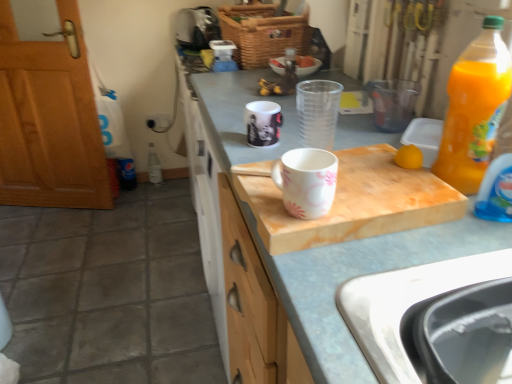
Locate an element on the screen. white glossy mug at center, the first coffee cup positioned from the top is located at coordinates (263, 123).

This screenshot has height=384, width=512. What do you see at coordinates (306, 181) in the screenshot? I see `white glossy mug at center, which ranks as the 2th coffee cup in back-to-front order` at bounding box center [306, 181].

Describe the element at coordinates (357, 275) in the screenshot. I see `white marble cutting board at center` at that location.

Find the location of a particular element. The height and width of the screenshot is (384, 512). black plastic sink at lower right is located at coordinates (406, 305).

Is white marble cutting board at center wider than white glossy mug at center, which is the 2th coffee cup from bottom to top?

Yes.

Who is shorter, white marble cutting board at center or white glossy mug at center, which ranks as the first coffee cup in back-to-front order?

With less height is white glossy mug at center, which ranks as the first coffee cup in back-to-front order.

From a real-world perspective, who is located higher, white marble cutting board at center or white glossy mug at center, which is the 2th coffee cup from bottom to top?

white glossy mug at center, which is the 2th coffee cup from bottom to top, is physically above.

In the scene shown: In the image, is white marble cutting board at center positioned in front of or behind white glossy mug at center, which is the 2th coffee cup from bottom to top?

white marble cutting board at center is behind white glossy mug at center, which is the 2th coffee cup from bottom to top.

From a real-world perspective, is woven brown basket at upper center physically below white glossy mug at center, the 1th coffee cup positioned from the bottom?

No, from a real-world perspective, woven brown basket at upper center is not below white glossy mug at center, the 1th coffee cup positioned from the bottom.

Between woven brown basket at upper center and white glossy mug at center, the 1th coffee cup positioned from the bottom, which one has smaller size?

white glossy mug at center, the 1th coffee cup positioned from the bottom.

What's the angular difference between woven brown basket at upper center and white glossy mug at center, acting as the first coffee cup starting from the front,'s facing directions?

There is a 120-degree angle between the facing directions of woven brown basket at upper center and white glossy mug at center, acting as the first coffee cup starting from the front.

Find the location of a particular element. The height and width of the screenshot is (384, 512). basket above the white glossy mug at center, acting as the first coffee cup starting from the front (from a real-world perspective) is located at coordinates (262, 33).

Does white marble cutting board at center have a larger size compared to translucent plastic bottle at right, which is counted as the 2th bottle, starting from the left?

Correct, white marble cutting board at center is larger in size than translucent plastic bottle at right, which is counted as the 2th bottle, starting from the left.

Considering the relative sizes of white marble cutting board at center and translucent plastic bottle at right, which appears as the 1th bottle when viewed from the front, in the image provided, is white marble cutting board at center shorter than translucent plastic bottle at right, which appears as the 1th bottle when viewed from the front,?

Incorrect, the height of white marble cutting board at center does not fall short of that of translucent plastic bottle at right, which appears as the 1th bottle when viewed from the front.

Is translucent plastic bottle at right, which is counted as the 2th bottle, starting from the left, a part of white marble cutting board at center?

No, translucent plastic bottle at right, which is counted as the 2th bottle, starting from the left, is located outside of white marble cutting board at center.

Between point (353, 137) and point (504, 49), which one is positioned behind?

The point (353, 137) is more distant.

Which is in front, point (290, 152) or point (259, 8)?

Positioned in front is point (290, 152).

This screenshot has height=384, width=512. Identify the location of coffee cup that is the 1st one below the woven brown basket at upper center (from a real-world perspective). (306, 181).

Considering the sizes of objects white glossy mug at center, acting as the first coffee cup starting from the front, and woven brown basket at upper center in the image provided, who is smaller, white glossy mug at center, acting as the first coffee cup starting from the front, or woven brown basket at upper center?

Smaller between the two is white glossy mug at center, acting as the first coffee cup starting from the front.

The image size is (512, 384). Identify the location of sink directly beneath the translucent plastic bottle at center, which is the 1th bottle from back to front (from a real-world perspective). (406, 305).

Is the depth of black plastic sink at lower right less than that of translucent plastic bottle at center, positioned as the 1th bottle in top-to-bottom order?

Yes, black plastic sink at lower right is in front of translucent plastic bottle at center, positioned as the 1th bottle in top-to-bottom order.

Is black plastic sink at lower right to the left or to the right of translucent plastic bottle at center, which ranks as the second bottle in right-to-left order, in the image?

Based on their positions, black plastic sink at lower right is located to the right of translucent plastic bottle at center, which ranks as the second bottle in right-to-left order.

Is black plastic sink at lower right far away from translucent plastic bottle at center, which is the 1th bottle from back to front?

Yes, black plastic sink at lower right is far from translucent plastic bottle at center, which is the 1th bottle from back to front.

Considering their positions, is black plastic sink at lower right located in front of or behind translucent plastic bottle at right, which is counted as the 2th bottle, starting from the left?

black plastic sink at lower right is in front of translucent plastic bottle at right, which is counted as the 2th bottle, starting from the left.

From the image's perspective, is black plastic sink at lower right located above or below translucent plastic bottle at right, the first bottle in the bottom-to-top sequence?

black plastic sink at lower right is situated lower than translucent plastic bottle at right, the first bottle in the bottom-to-top sequence, in the image.

Is black plastic sink at lower right looking in the opposite direction of translucent plastic bottle at right, the 2th bottle from the back?

black plastic sink at lower right is not turned away from translucent plastic bottle at right, the 2th bottle from the back.

Based on the photo, in the image, is white marble cutting board at center positioned in front of or behind white marble cutting board at center?

Visually, white marble cutting board at center is located in front of white marble cutting board at center.

From a real-world perspective, is white marble cutting board at center located higher than white marble cutting board at center?

Yes, from a real-world perspective, white marble cutting board at center is over white marble cutting board at center

Can white marble cutting board at center be found inside white marble cutting board at center?

No.

Considering the sizes of white marble cutting board at center and white marble cutting board at center in the image, is white marble cutting board at center taller or shorter than white marble cutting board at center?

Clearly, white marble cutting board at center is shorter compared to white marble cutting board at center.

There is a white marble cutting board at center. Identify the location of the 2nd coffee cup above it (from the image's perspective). This screenshot has height=384, width=512. (263, 123).

From a real-world perspective, which coffee cup is the 1st one underneath the woven brown basket at upper center? Please provide its 2D coordinates.

[(306, 181)]

Based on the photo, when comparing their distances from wooden door at left, does translucent plastic bottle at right, the first bottle in the bottom-to-top sequence, or translucent plastic bottle at center, positioned as the second bottle in bottom-to-top order, seem further?

translucent plastic bottle at right, the first bottle in the bottom-to-top sequence, is further to wooden door at left.

Estimate the real-world distances between objects in this image. Which object is closer to white marble cutting board at center, white glossy mug at center, which ranks as the first coffee cup in back-to-front order, or wooden door at left?

The object closer to white marble cutting board at center is white glossy mug at center, which ranks as the first coffee cup in back-to-front order.

When comparing their distances from white marble cutting board at center, does white glossy mug at center, acting as the first coffee cup starting from the front, or white marble cutting board at center seem further?

Among the two, white marble cutting board at center is located further to white marble cutting board at center.

From the image, which object appears to be nearer to white glossy mug at center, the first coffee cup positioned from the top, wooden door at left or white glossy mug at center, acting as the 2th coffee cup starting from the top?

white glossy mug at center, acting as the 2th coffee cup starting from the top, lies closer to white glossy mug at center, the first coffee cup positioned from the top, than the other object.

Which object lies further to the anchor point wooden door at left, white glossy mug at center, acting as the first coffee cup starting from the front, or white marble cutting board at center?

Among the two, white glossy mug at center, acting as the first coffee cup starting from the front, is located further to wooden door at left.

Looking at this image, estimate the real-world distances between objects in this image. Which object is closer to black plastic sink at lower right, translucent plastic bottle at center, which ranks as the second bottle in right-to-left order, or white glossy mug at center, acting as the 2th coffee cup starting from the top?

Among the two, white glossy mug at center, acting as the 2th coffee cup starting from the top, is located nearer to black plastic sink at lower right.

From the image, which object appears to be farther from white marble cutting board at center, white glossy mug at center, the second coffee cup positioned from the front, or black plastic sink at lower right?

white glossy mug at center, the second coffee cup positioned from the front, is positioned further to the anchor white marble cutting board at center.

When comparing their distances from translucent plastic bottle at right, which is counted as the 2th bottle, starting from the left, does woven brown basket at upper center or white marble cutting board at center seem closer?

white marble cutting board at center is positioned closer to the anchor translucent plastic bottle at right, which is counted as the 2th bottle, starting from the left.

Identify the location of coffee cup between white glossy mug at center, acting as the first coffee cup starting from the front, and translucent plastic bottle at center, the 1th bottle from the left, in the front-back direction. This screenshot has width=512, height=384. (263, 123).

Locate an element on the screen. cutting board positioned between white glossy mug at center, which ranks as the 2th coffee cup in back-to-front order, and white glossy mug at center, the second coffee cup positioned from the front, from near to far is located at coordinates coord(350,201).

Image resolution: width=512 pixels, height=384 pixels. Find the location of `cutting board between black plastic sink at lower right and white marble cutting board at center from front to back`. cutting board between black plastic sink at lower right and white marble cutting board at center from front to back is located at coordinates (350, 201).

Locate an element on the screen. The image size is (512, 384). cutting board between white glossy mug at center, acting as the first coffee cup starting from the front, and woven brown basket at upper center in the front-back direction is located at coordinates (350, 201).